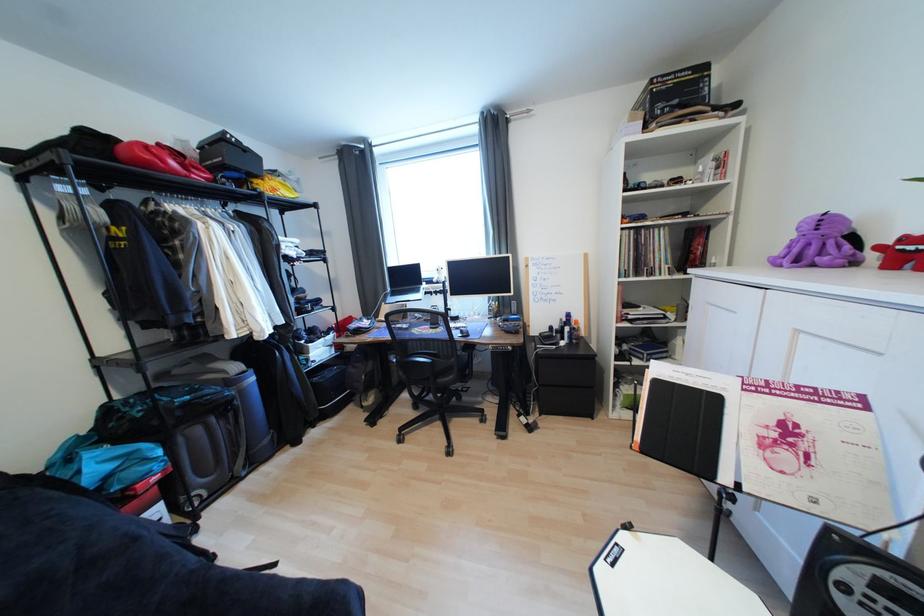
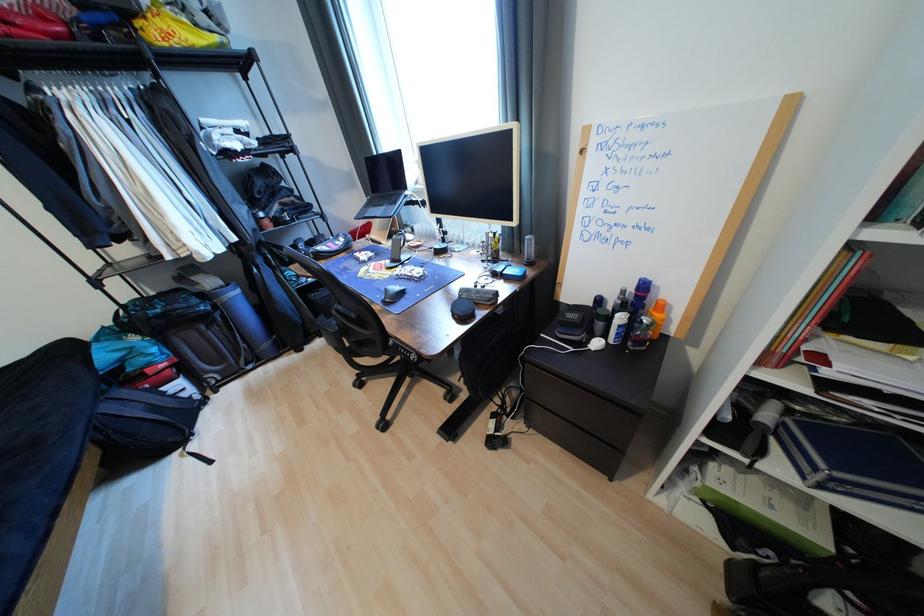
Find the pixel in the second image that matches (x=574, y=330) in the first image.

(627, 320)